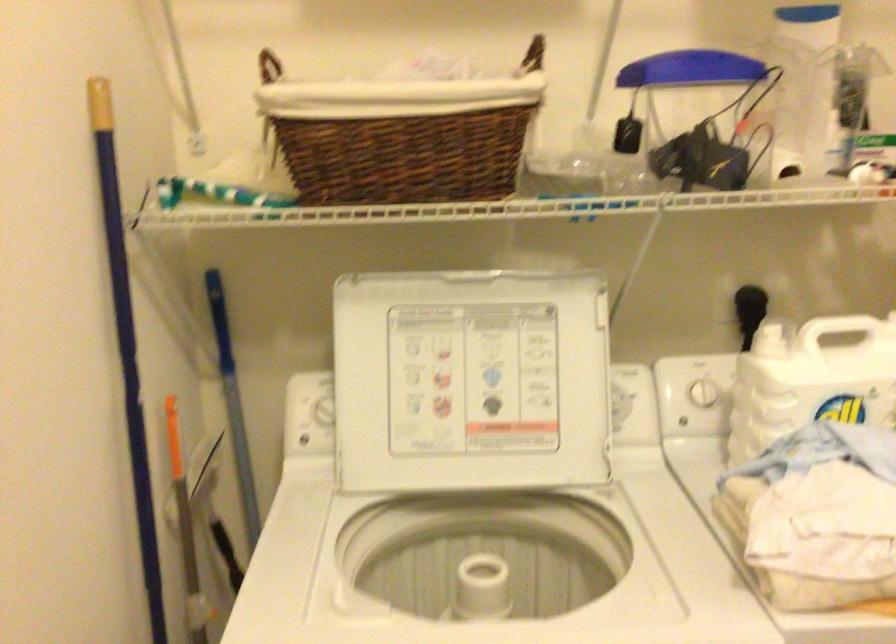
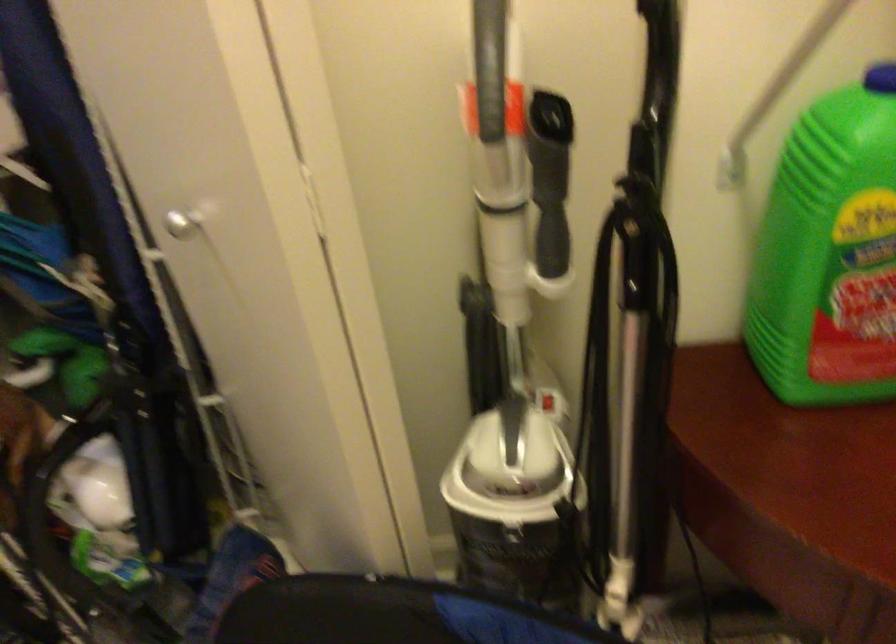
Based on the continuous images, in which direction is the camera rotating?

The rotation direction of the camera is right-down.